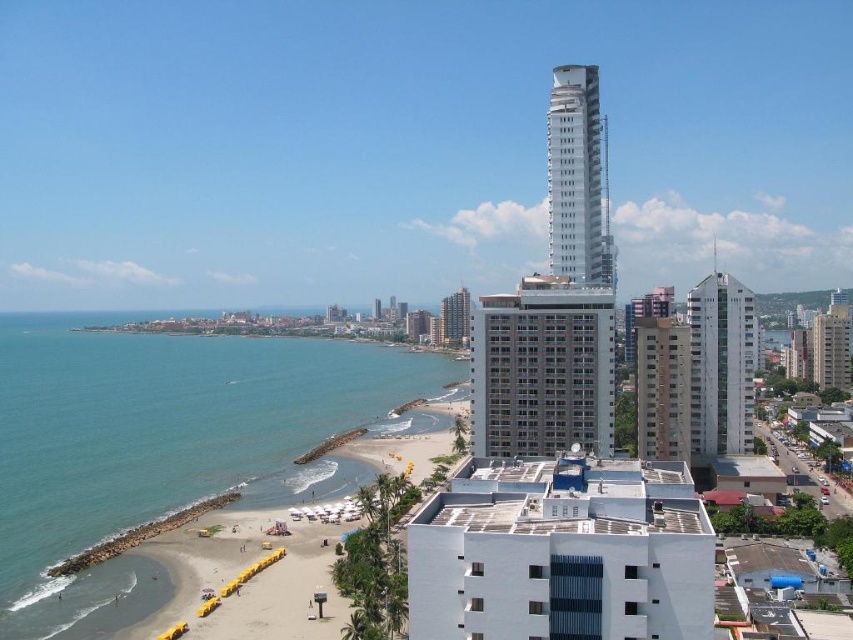
In the scene shown: Is white concrete building at center thinner than white smooth tower at upper right?

Yes, white concrete building at center is thinner than white smooth tower at upper right.

Which is behind, point (502, 314) or point (549, 170)?

The point (549, 170) is behind.

Find the location of a particular element. The image size is (853, 640). white concrete building at center is located at coordinates (543, 369).

Is point (461, 545) less distant than point (460, 296)?

Yes, point (461, 545) is in front of point (460, 296).

Is white smooth building at center to the right of matte gray building at center from the viewer's perspective?

Indeed, white smooth building at center is positioned on the right side of matte gray building at center.

Identify the location of white smooth building at center. This screenshot has width=853, height=640. (561, 554).

What do you see at coordinates (561, 554) in the screenshot? I see `white smooth building at center` at bounding box center [561, 554].

Does white smooth building at center come behind white concrete building at center?

No, it is in front of white concrete building at center.

Is point (640, 541) positioned behind point (488, 348)?

No.

Image resolution: width=853 pixels, height=640 pixels. I want to click on white smooth building at center, so click(x=561, y=554).